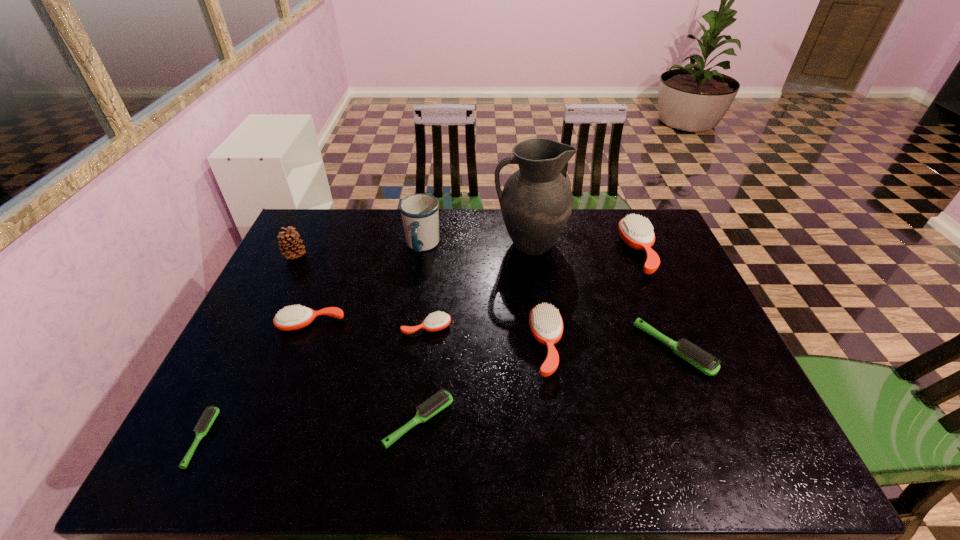
Locate an element on the screen. The height and width of the screenshot is (540, 960). free spot that satisfies the following two spatial constraints: 1. on the back side of the rightmost orange hairbrush; 2. on the side of the pitcher with the handle is located at coordinates (635, 244).